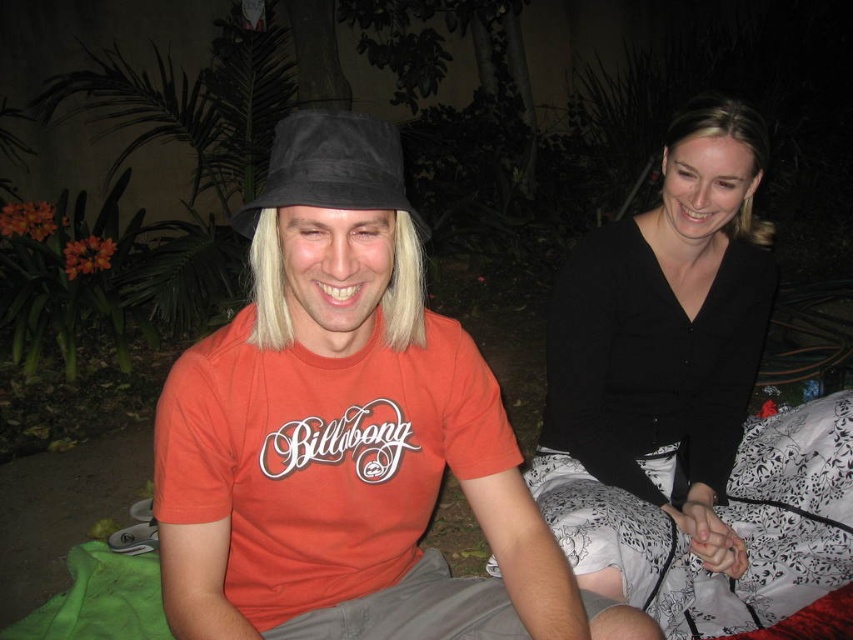
Is point (492, 435) positioned behind point (767, 442)?

That is False.

Can you confirm if matte black bucket hat at left is shorter than white floral fabric at lower right?

Incorrect, matte black bucket hat at left's height does not fall short of white floral fabric at lower right's.

You are a GUI agent. You are given a task and a screenshot of the screen. Output one action in this format:
    pyautogui.click(x=<x>, y=<y>)
    Task: Click on the matte black bucket hat at left
    The height and width of the screenshot is (640, 853).
    Given the screenshot: What is the action you would take?
    pyautogui.click(x=345, y=433)

Can you confirm if black matte shirt at upper right is shorter than black suede baseball hat at upper center?

In fact, black matte shirt at upper right may be taller than black suede baseball hat at upper center.

Does black matte shirt at upper right appear on the right side of black suede baseball hat at upper center?

Yes, black matte shirt at upper right is to the right of black suede baseball hat at upper center.

Find the location of `black matte shirt at upper right`. black matte shirt at upper right is located at coordinates (668, 332).

The image size is (853, 640). I want to click on black matte shirt at upper right, so click(668, 332).

Is matte black bucket hat at left positioned behind black matte shirt at upper right?

No, matte black bucket hat at left is in front of black matte shirt at upper right.

Who is more distant from viewer, (515, 579) or (595, 400)?

The point (595, 400) is more distant.

Identify the location of matte black bucket hat at left. The image size is (853, 640). (345, 433).